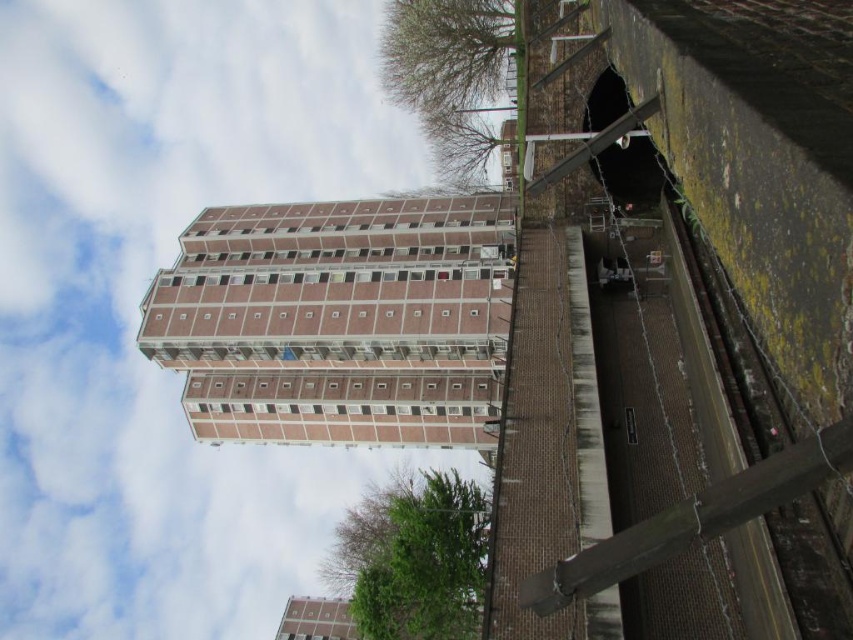
Consider the image. You are a city planner reviewing this urban area. You need to determine which structure occupies more space in the scene for zoning purposes. Which one is bigger between the brick building at center and the brick textured building at center?

The brick building at center is larger in size compared to the brick textured building at center, so it occupies more space in the scene.

You are a construction worker who needs to transport materials from the brick building at center to the brick textured building at center. The path between them is a narrow alleyway. The alleyway is only 4 meters wide. Can you safely pass through with a truck that is 3.5 meters wide?

The distance between the brick building at center and brick textured building at center is 46.62 meters, but the alleyway width is 4 meters. Since the truck is 3.5 meters wide, it can safely pass through the alleyway as it is narrower than the available width.

You are standing in front of the brick building at center and the brick textured building at center. Which building is closer to you?

The brick building at center is closer to the viewer than the brick textured building at center.